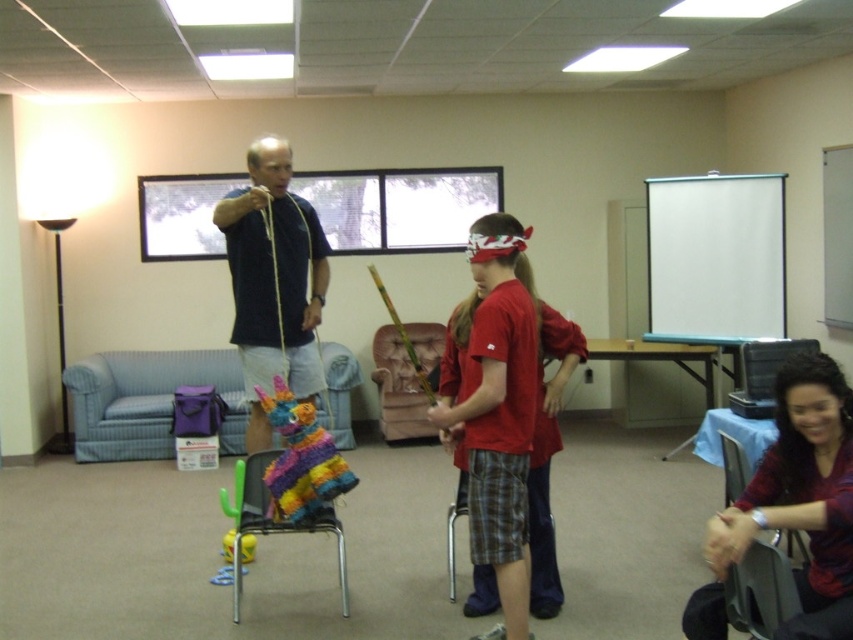
Question: Among these objects, which one is farthest from the camera?

Choices:
 (A) multicolored fabric pinata at center
 (B) red matte shirt at center
 (C) gray plastic chair at lower right

Answer: (A)

Question: Is gray plastic chair at lower right further to the viewer compared to yellow rubber toy at center?

Choices:
 (A) no
 (B) yes

Answer: (A)

Question: Estimate the real-world distances between objects in this image. Which object is closer to the velvet pink armchair at center?

Choices:
 (A) gray plastic chair at lower right
 (B) multicolored fabric pinata at center
 (C) red matte shirt at center

Answer: (B)

Question: Based on their relative distances, which object is nearer to the multicolored fabric pinata at center?

Choices:
 (A) velvet pink armchair at center
 (B) yellow rubber toy at center

Answer: (B)

Question: Is matte red shirt at center to the right of yellow rubber toy at center from the viewer's perspective?

Choices:
 (A) no
 (B) yes

Answer: (B)

Question: Can you confirm if matte red shirt at center is positioned below red matte shirt at center?

Choices:
 (A) yes
 (B) no

Answer: (A)